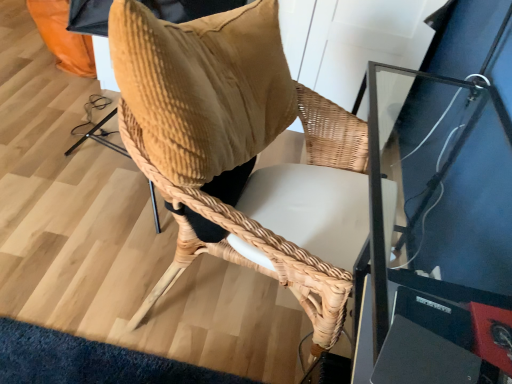
Question: From the image's perspective, relative to velvet brown bean bag chair at center, is woven wood chair at center above or below?

Choices:
 (A) below
 (B) above

Answer: (A)

Question: Choose the correct answer: Is woven wood chair at center inside velvet brown bean bag chair at center or outside it?

Choices:
 (A) inside
 (B) outside

Answer: (B)

Question: From a real-world perspective, relative to velvet brown bean bag chair at center, is woven wood chair at center vertically above or below?

Choices:
 (A) below
 (B) above

Answer: (A)

Question: From the image's perspective, is velvet brown bean bag chair at center located above or below woven wood chair at center?

Choices:
 (A) below
 (B) above

Answer: (B)

Question: From a real-world perspective, is velvet brown bean bag chair at center positioned above or below woven wood chair at center?

Choices:
 (A) below
 (B) above

Answer: (B)

Question: Is velvet brown bean bag chair at center inside the boundaries of woven wood chair at center, or outside?

Choices:
 (A) outside
 (B) inside

Answer: (B)

Question: In terms of height, does velvet brown bean bag chair at center look taller or shorter compared to woven wood chair at center?

Choices:
 (A) short
 (B) tall

Answer: (A)